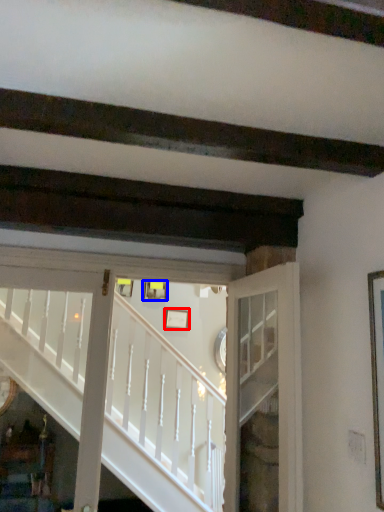
Question: Which object appears farthest to the camera in this image, picture frame (highlighted by a red box) or picture frame (highlighted by a blue box)?

Choices:
 (A) picture frame
 (B) picture frame

Answer: (B)